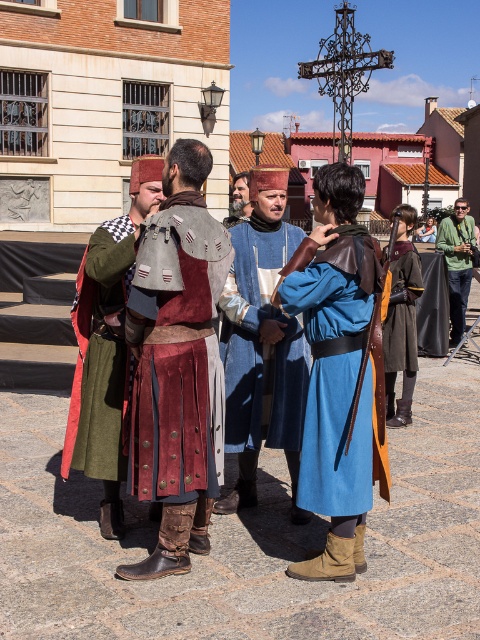
You are a tailor observing the historical reenactment. You need to determine which garment requires more fabric to make between the blue woolen robe at center and the green fabric jacket at right. Based on their sizes, which one would need more fabric?

The blue woolen robe at center has a larger size compared to the green fabric jacket at right, so it would require more fabric to make.